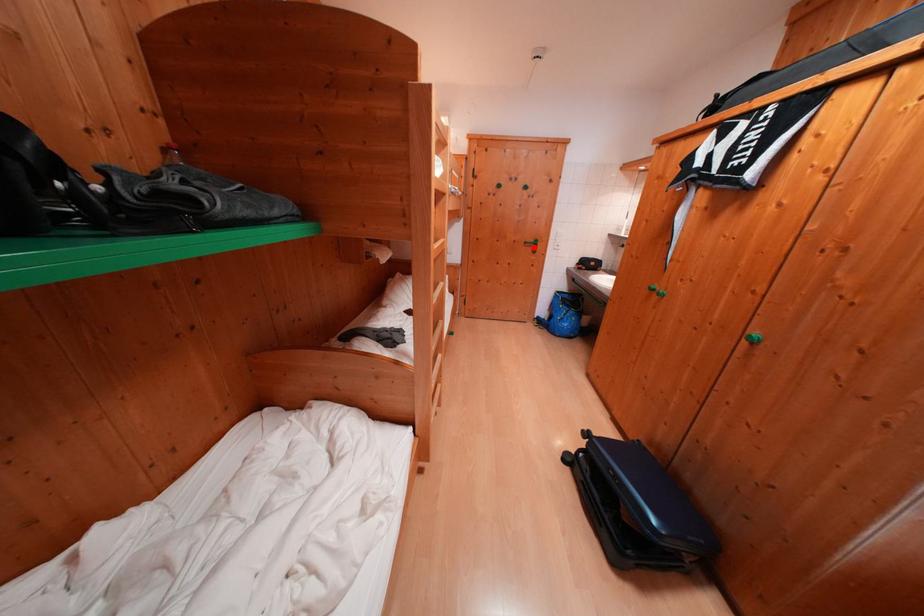
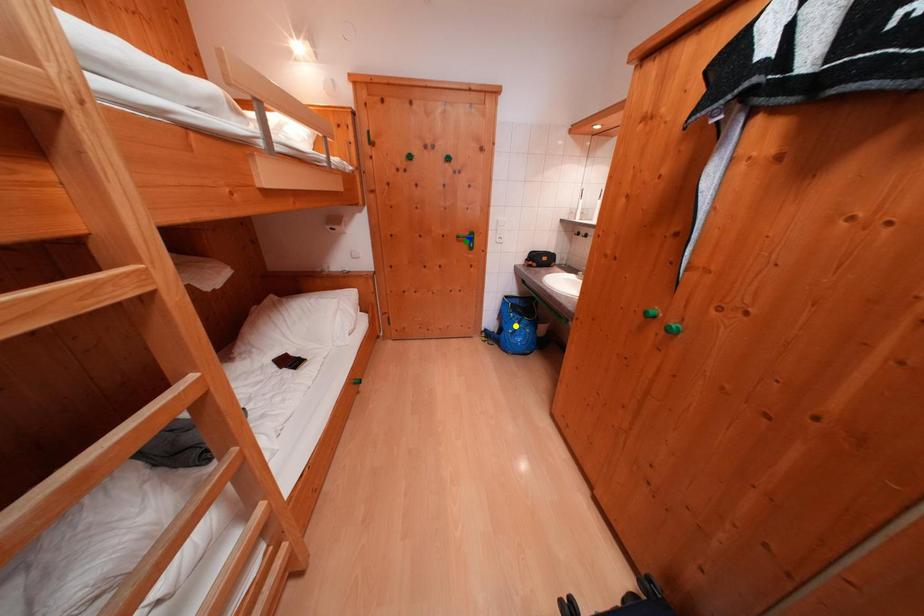
Question: I am providing you with two images of the same scene from different viewpoints. A red point is marked on the first image. You are given multiple points on the second image. Which point in image 2 is actually the same real-world point as the red point in image 1?

Choices:
 (A) blue point
 (B) yellow point
 (C) green point

Answer: (C)